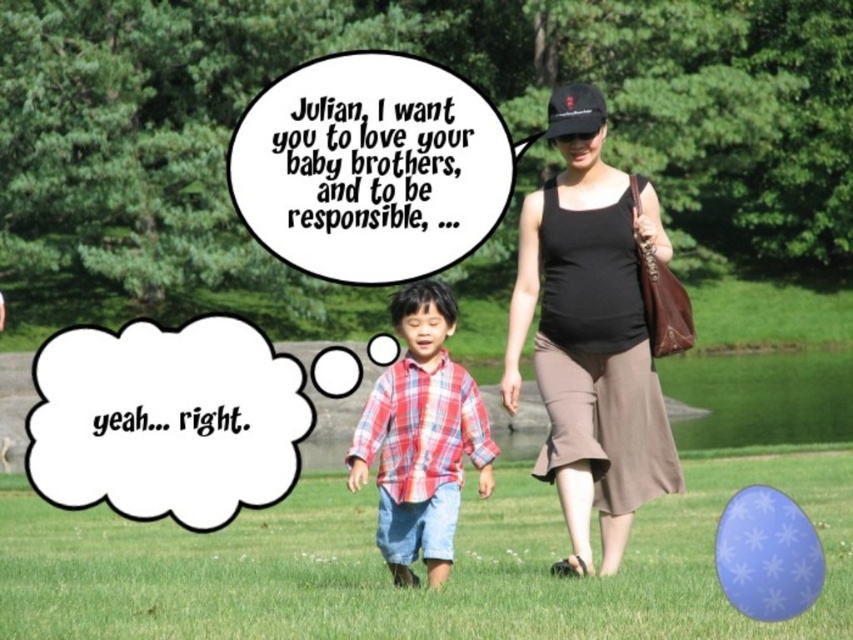
You are a photographer trying to capture a candid shot of the two people in the scene. You notice the plaid fabric shirt at center and the black fabric baseball cap at upper center. Which object should you focus on first if you want to capture the subject who is facing forward?

The plaid fabric shirt at center should be focused on first because it is to the left of the black fabric baseball cap at upper center, indicating the person wearing the shirt is facing forward while the cap wearer is looking slightly upward.

Looking at this image, based on the scene, can you determine the position of the green grass at lower center relative to the black fabric tank top at center?

The green grass at lower center is below the black fabric tank top at center.

Based on the scene description, can you determine if the black fabric tank top at center is wider than the black fabric baseball cap at upper center?

The black fabric tank top at center is wider than the black fabric baseball cap at upper center according to the description.